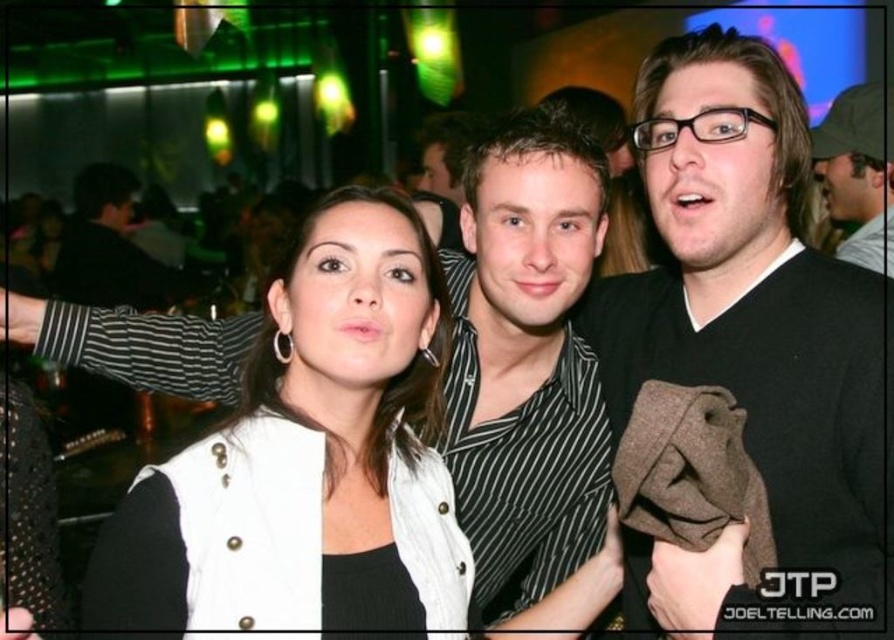
Question: Is black matte shirt at center to the right of black striped shirt at center from the viewer's perspective?

Choices:
 (A) yes
 (B) no

Answer: (A)

Question: Is the position of white textured vest at center more distant than that of black striped shirt at left?

Choices:
 (A) yes
 (B) no

Answer: (B)

Question: Does black striped shirt at center come in front of matte black jacket at upper right?

Choices:
 (A) no
 (B) yes

Answer: (B)

Question: Among these points, which one is farthest from the camera?

Choices:
 (A) (833, 112)
 (B) (537, 472)

Answer: (A)

Question: Which is farther from the black striped shirt at center?

Choices:
 (A) white textured vest at center
 (B) black striped shirt at left
 (C) matte black jacket at upper right

Answer: (B)

Question: Which of the following is the farthest from the observer?

Choices:
 (A) black striped shirt at center
 (B) black striped shirt at left

Answer: (B)